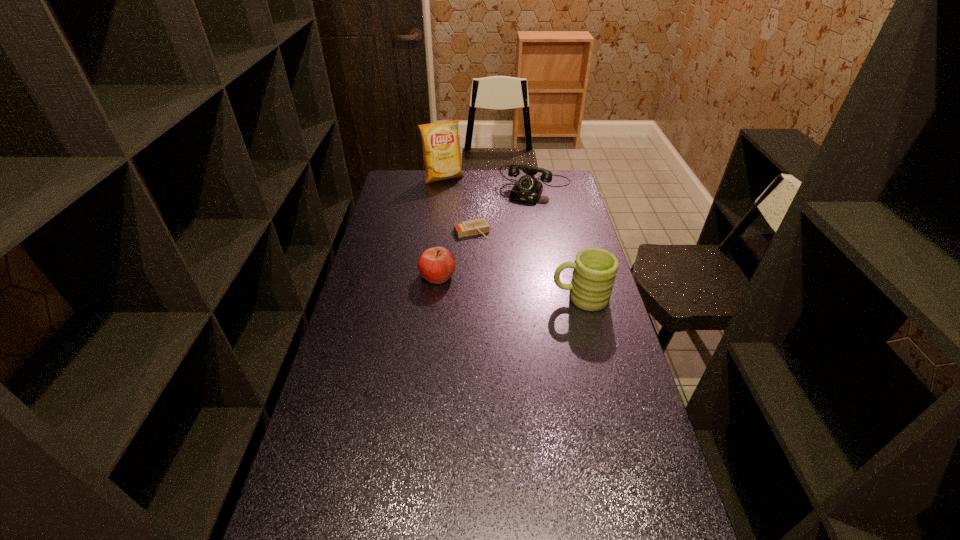
The image size is (960, 540). Find the location of `telephone situated at the far edge`. telephone situated at the far edge is located at coordinates (527, 189).

At what (x,y) coordinates should I click in order to perform the action: click on mug situated at the right edge. Please return your answer as a coordinate pair (x, y). The width and height of the screenshot is (960, 540). Looking at the image, I should click on (595, 269).

The width and height of the screenshot is (960, 540). What are the coordinates of `telephone at the right edge` in the screenshot? It's located at (527, 189).

The height and width of the screenshot is (540, 960). I want to click on object at the far right corner, so click(527, 189).

Identify the location of vacant region at the near edge of the desktop. (501, 531).

You are a GUI agent. You are given a task and a screenshot of the screen. Output one action in this format:
    pyautogui.click(x=<x>, y=<y>)
    Task: Click on the vacant space at the left edge of the desktop
    This screenshot has width=960, height=540.
    Given the screenshot: What is the action you would take?
    pyautogui.click(x=352, y=343)

This screenshot has height=540, width=960. In order to click on vacant space at the right edge of the desktop in this screenshot , I will do `click(551, 204)`.

You are a GUI agent. You are given a task and a screenshot of the screen. Output one action in this format:
    pyautogui.click(x=<x>, y=<y>)
    Task: Click on the vacant space at the far left corner of the desktop
    This screenshot has height=540, width=960.
    Given the screenshot: What is the action you would take?
    pyautogui.click(x=394, y=192)

This screenshot has width=960, height=540. What are the coordinates of `blank area at the far right corner` in the screenshot? It's located at (553, 194).

What are the coordinates of `free space that is in between the tallest object and the fourth shortest object` in the screenshot? It's located at (512, 238).